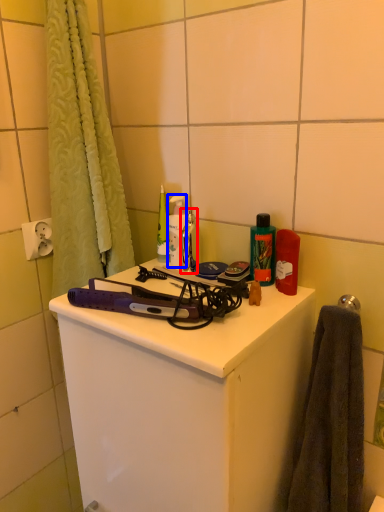
Question: Which object is further to the camera taking this photo, faucet (highlighted by a red box) or toiletry (highlighted by a blue box)?

Choices:
 (A) faucet
 (B) toiletry

Answer: (B)